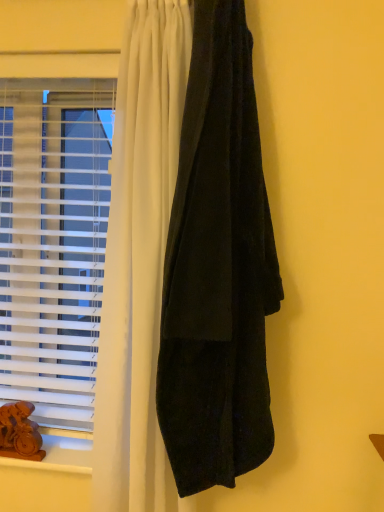
Question: Based on their sizes in the image, would you say wooden at lower left is bigger or smaller than brown wooden animal at lower left?

Choices:
 (A) small
 (B) big

Answer: (B)

Question: Considering their positions, is wooden at lower left located in front of or behind brown wooden animal at lower left?

Choices:
 (A) front
 (B) behind

Answer: (A)

Question: Which object is positioned farthest from the brown wooden animal at lower left?

Choices:
 (A) wooden at lower left
 (B) velvet black curtain at right
 (C) white plastic blinds at left

Answer: (B)

Question: Which object is the farthest from the velvet black curtain at right?

Choices:
 (A) white plastic blinds at left
 (B) wooden at lower left
 (C) brown wooden animal at lower left

Answer: (C)